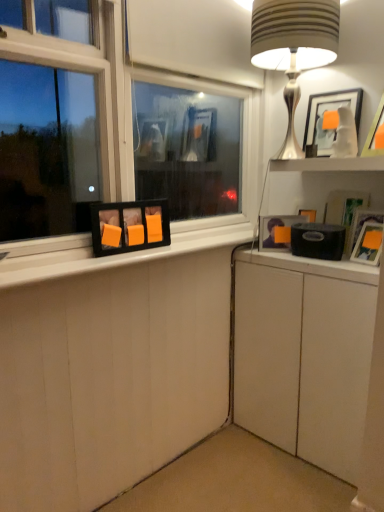
Where is `vacant space situated above white matte cabinet at lower right (from a real-world perspective)`? This screenshot has width=384, height=512. vacant space situated above white matte cabinet at lower right (from a real-world perspective) is located at coordinates (312, 255).